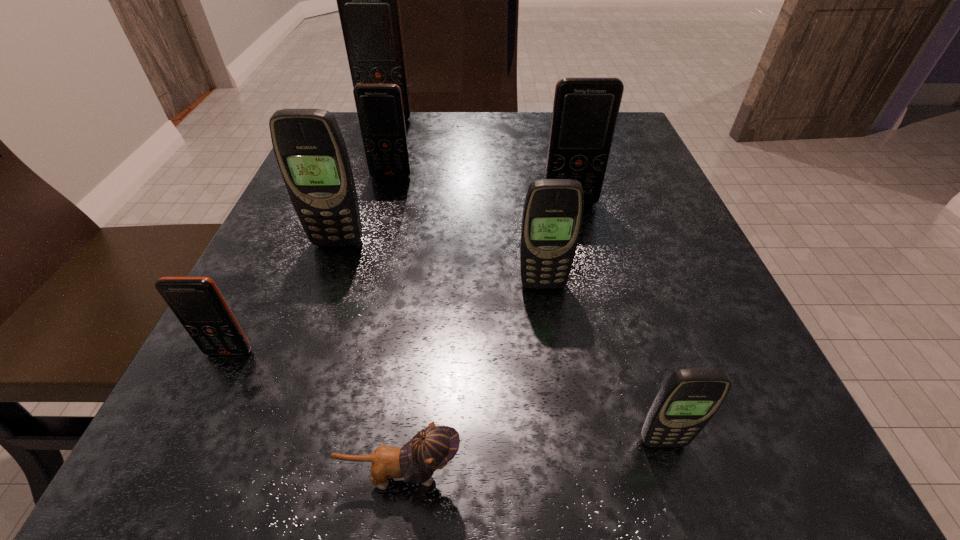
The image size is (960, 540). I want to click on blank space at the near edge, so click(x=300, y=490).

Identify the location of vacant space at the left edge of the desktop. (200, 395).

At what (x,y) coordinates should I click in order to perform the action: click on vacant space at the right edge. Please return your answer as a coordinate pair (x, y). Looking at the image, I should click on (602, 210).

I want to click on free region at the far left corner, so click(x=349, y=130).

In order to click on empty space between the fourth farthest object and the kitten in this screenshot , I will do `click(370, 359)`.

I want to click on free space between the nearest object and the farthest cellular telephone, so click(x=395, y=297).

In order to click on empty location between the nearest object and the smallest orange cellular telephone in this screenshot , I will do `click(316, 414)`.

Identify the location of empty location between the farthest orange cellular telephone and the fifth nearest cellular telephone. (478, 161).

Locate an element on the screen. The width and height of the screenshot is (960, 540). unoccupied area between the kitten and the second farthest cellular telephone is located at coordinates (396, 326).

Locate an element on the screen. free space between the nearest object and the farthest object is located at coordinates click(395, 297).